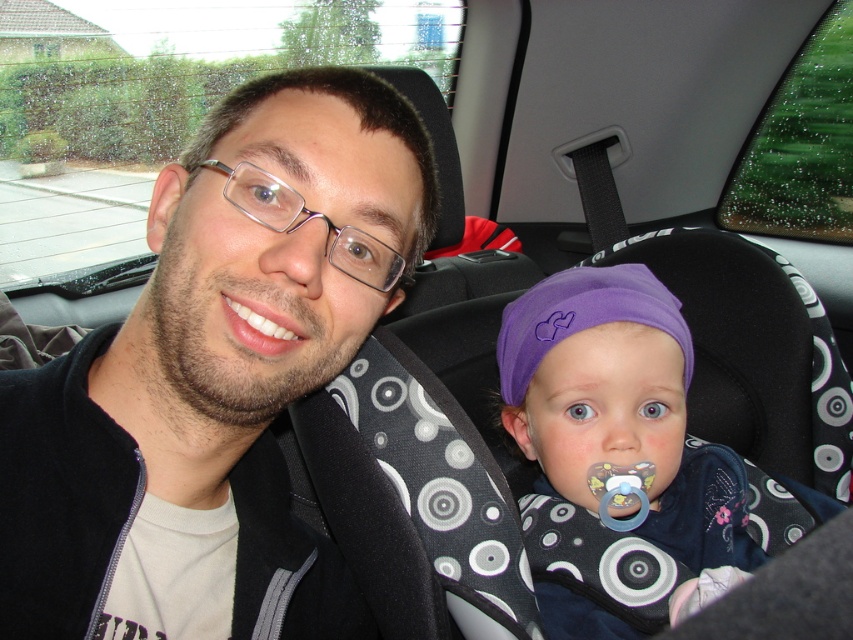
Question: Which of the following is the farthest from the observer?

Choices:
 (A) purple fabric headband at center
 (B) matte black jacket at center

Answer: (A)

Question: Is matte black jacket at center positioned behind purple fabric headband at center?

Choices:
 (A) no
 (B) yes

Answer: (A)

Question: Does matte black jacket at center have a smaller size compared to purple fabric headband at center?

Choices:
 (A) yes
 (B) no

Answer: (B)

Question: Among these objects, which one is farthest from the camera?

Choices:
 (A) matte black jacket at center
 (B) purple fabric headband at center

Answer: (B)

Question: Can you confirm if matte black jacket at center is positioned to the right of purple fabric headband at center?

Choices:
 (A) no
 (B) yes

Answer: (A)